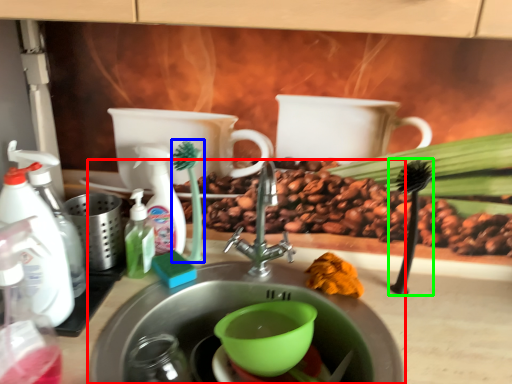
Question: Considering the real-world distances, which object is closest to sink (highlighted by a red box)? plant (highlighted by a blue box) or plant (highlighted by a green box).

Choices:
 (A) plant
 (B) plant

Answer: (A)